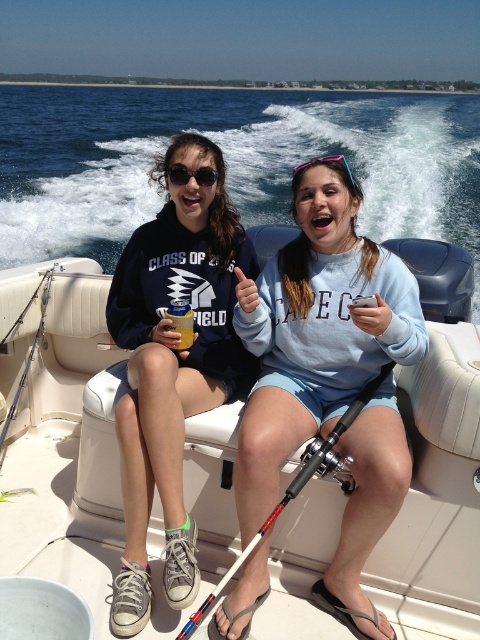
Question: Estimate the real-world distances between objects in this image. Which object is farther from the clear plastic sunglasses at center?

Choices:
 (A) red and black fishing pole at center
 (B) matte black sunglasses at upper center

Answer: (A)

Question: Can you confirm if red and black fishing pole at center is thinner than matte black sunglasses at upper center?

Choices:
 (A) no
 (B) yes

Answer: (A)

Question: Among these objects, which one is farthest from the camera?

Choices:
 (A) white plastic boat at center
 (B) light blue cotton sweatshirt at center

Answer: (A)

Question: Is matte black hoodie at center behind matte black sunglasses at upper center?

Choices:
 (A) yes
 (B) no

Answer: (B)

Question: Which of the following is the farthest from the observer?

Choices:
 (A) matte black hoodie at center
 (B) white plastic boat at center
 (C) light blue cotton sweatshirt at center

Answer: (B)

Question: Is red and black fishing pole at center to the left of clear plastic sunglasses at center from the viewer's perspective?

Choices:
 (A) yes
 (B) no

Answer: (A)